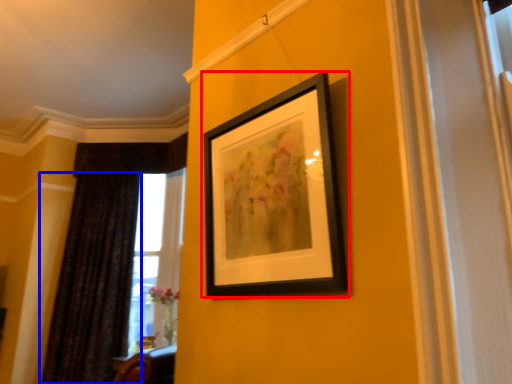
Question: Which object is further to the camera taking this photo, picture frame (highlighted by a red box) or curtain (highlighted by a blue box)?

Choices:
 (A) picture frame
 (B) curtain

Answer: (B)